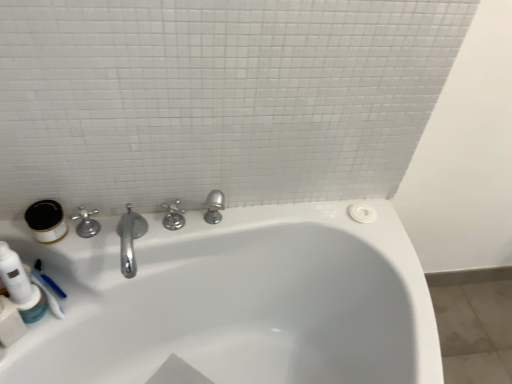
This screenshot has width=512, height=384. In order to click on empty space that is in between polished chrome faucet at left, which ranks as the first tap in left-to-right order, and polished chrome faucet at center, which is counted as the 2th tap, starting from the left in this screenshot , I will do `click(132, 225)`.